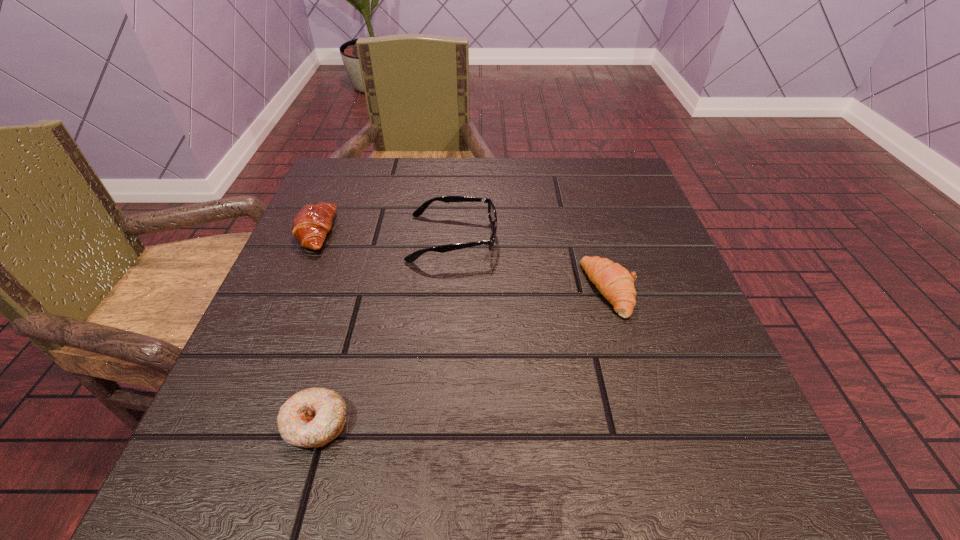
Find the location of a particular element. This screenshot has width=960, height=540. vacant region between the second object from right to left and the third object from right to left is located at coordinates (384, 331).

You are a GUI agent. You are given a task and a screenshot of the screen. Output one action in this format:
    pyautogui.click(x=<x>, y=<y>)
    Task: Click on the free point between the second object from right to left and the left crescent roll
    The width and height of the screenshot is (960, 540).
    Given the screenshot: What is the action you would take?
    pyautogui.click(x=384, y=235)

This screenshot has height=540, width=960. I want to click on free space between the spectacles and the leftmost object, so click(x=384, y=235).

The image size is (960, 540). I want to click on vacant point located between the farther crescent roll and the spectacles, so click(x=384, y=235).

You are a GUI agent. You are given a task and a screenshot of the screen. Output one action in this format:
    pyautogui.click(x=<x>, y=<y>)
    Task: Click on the vacant space that is in between the spectacles and the rightmost object
    The height and width of the screenshot is (540, 960).
    Given the screenshot: What is the action you would take?
    pyautogui.click(x=532, y=264)

You are a GUI agent. You are given a task and a screenshot of the screen. Output one action in this format:
    pyautogui.click(x=<x>, y=<y>)
    Task: Click on the empty space between the leftmost object and the nearest object
    The width and height of the screenshot is (960, 540).
    Given the screenshot: What is the action you would take?
    pyautogui.click(x=316, y=328)

This screenshot has width=960, height=540. In order to click on empty space between the right crescent roll and the farther crescent roll in this screenshot , I will do [463, 261].

Locate which object ranks second in proximity to the second object from left to right. Please provide its 2D coordinates. Your answer should be formatted as a tuple, i.e. [(x, y)], where the tuple contains the x and y coordinates of a point satisfying the conditions above.

[(311, 224)]

Locate which object is the third closest to the leftmost object. Please provide its 2D coordinates. Your answer should be formatted as a tuple, i.e. [(x, y)], where the tuple contains the x and y coordinates of a point satisfying the conditions above.

[(614, 282)]

What are the coordinates of `blank space that satisfies the following two spatial constraints: 1. on the front-facing side of the rightmost object; 2. on the right side of the third object from left to right` in the screenshot? It's located at (449, 290).